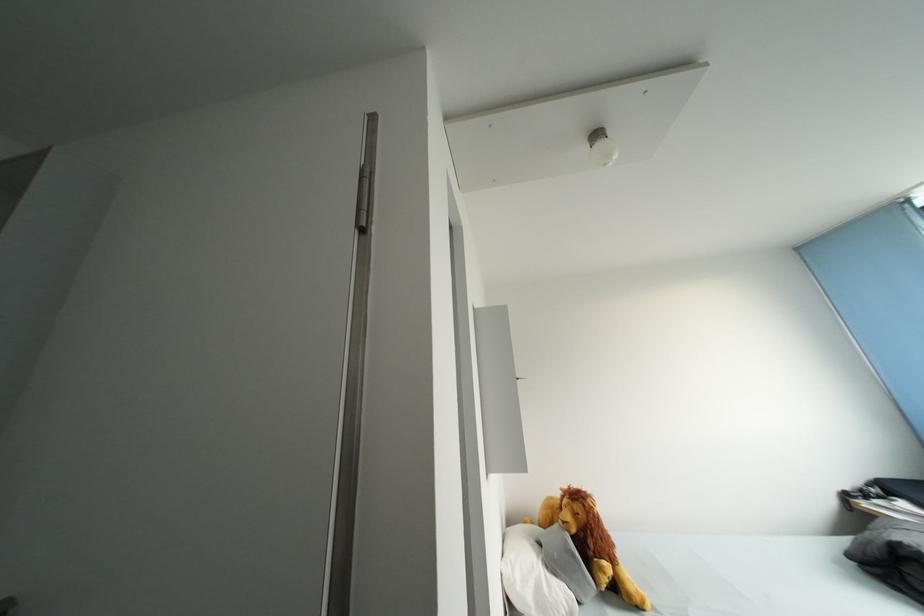
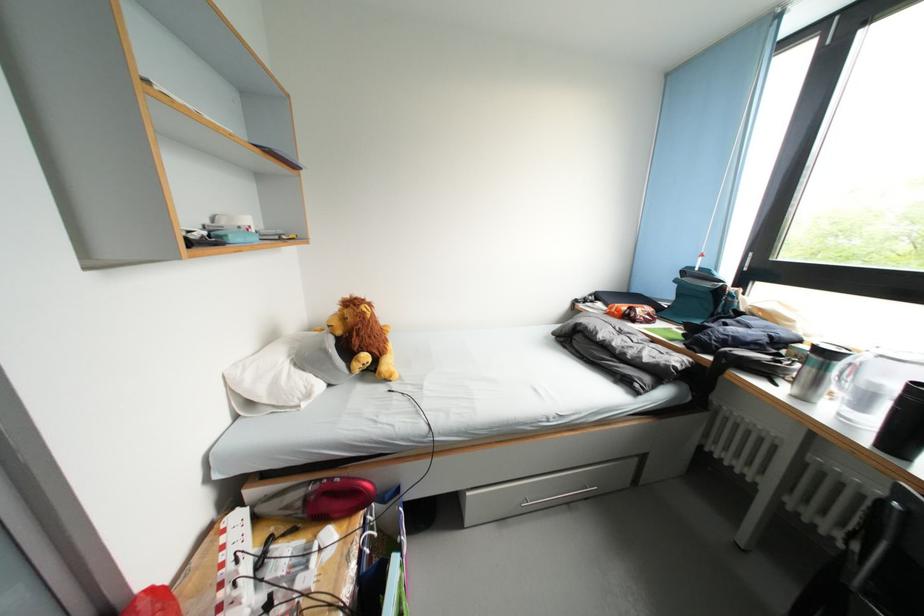
The first image is from the beginning of the video and the second image is from the end. How did the camera likely rotate when shooting the video?

The camera rotated toward right-down.